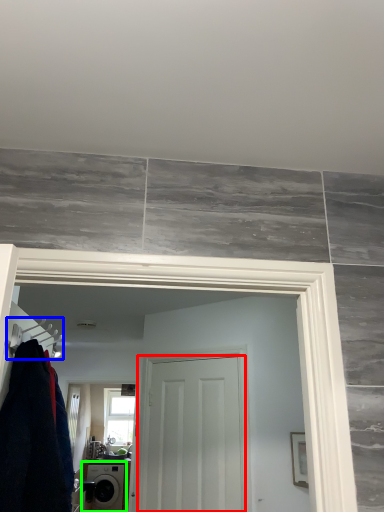
Question: Which is nearer to the door (highlighted by a red box)? hanger (highlighted by a blue box) or washing machine (highlighted by a green box).

Choices:
 (A) hanger
 (B) washing machine

Answer: (A)